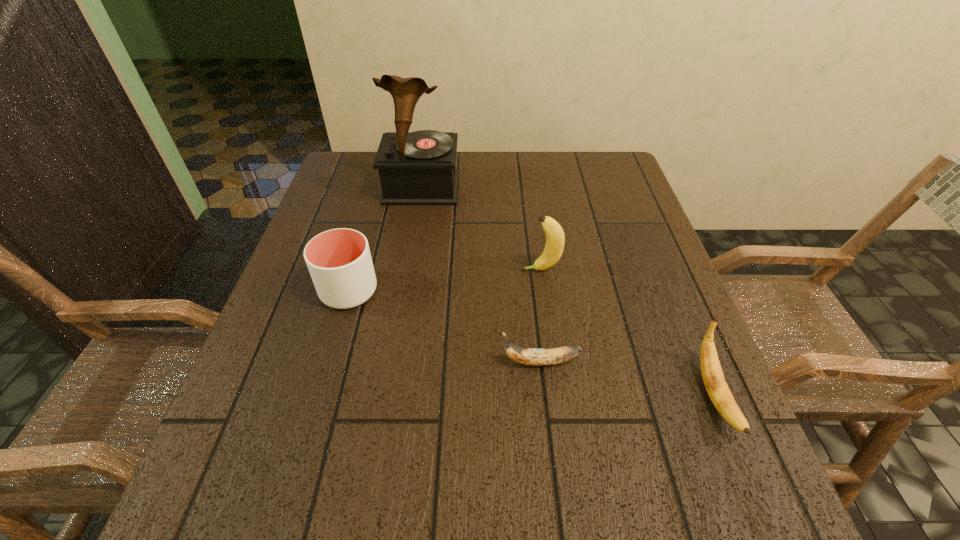
Where is `vacant region between the shortest banana and the cup`? vacant region between the shortest banana and the cup is located at coordinates (x=444, y=327).

The height and width of the screenshot is (540, 960). Find the location of `unoccupied position between the rightmost object and the third tallest object`. unoccupied position between the rightmost object and the third tallest object is located at coordinates (531, 343).

Locate an element on the screen. free space between the third tallest object and the phonograph_record is located at coordinates coord(385,239).

I want to click on vacant space in between the second shortest object and the cup, so click(531, 343).

In order to click on free space between the shortest banana and the rightmost object in this screenshot , I will do `click(627, 379)`.

You are a GUI agent. You are given a task and a screenshot of the screen. Output one action in this format:
    pyautogui.click(x=<x>, y=<y>)
    Task: Click on the free space between the rightmost banana and the farthest object
    The height and width of the screenshot is (540, 960).
    Given the screenshot: What is the action you would take?
    pyautogui.click(x=567, y=292)

Find the location of a particular element. The image size is (960, 540). vacant area that lies between the phonograph_record and the third tallest object is located at coordinates (385, 239).

The width and height of the screenshot is (960, 540). Find the location of `the fourth closest object relative to the rightmost object`. the fourth closest object relative to the rightmost object is located at coordinates (416, 168).

Identify which object is the second closest to the second tallest object. Please provide its 2D coordinates. Your answer should be formatted as a tuple, i.e. [(x, y)], where the tuple contains the x and y coordinates of a point satisfying the conditions above.

[(416, 168)]

You are a GUI agent. You are given a task and a screenshot of the screen. Output one action in this format:
    pyautogui.click(x=<x>, y=<y>)
    Task: Click on the closest banana to the shortest banana
    This screenshot has height=540, width=960.
    Given the screenshot: What is the action you would take?
    pyautogui.click(x=713, y=377)